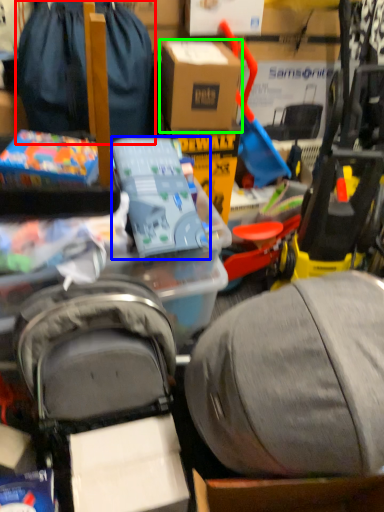
Question: Considering the real-world distances, which object is farthest from luggage and bags (highlighted by a red box)? toy (highlighted by a blue box) or box (highlighted by a green box)?

Choices:
 (A) toy
 (B) box

Answer: (A)